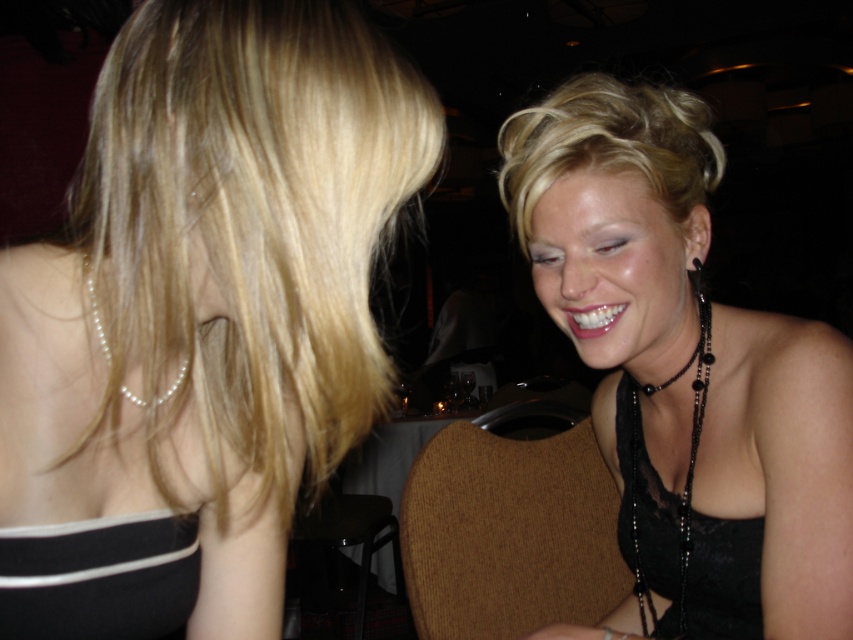
Question: From the image, what is the correct spatial relationship of blonde smooth hair at upper left in relation to black lace dress at upper right?

Choices:
 (A) right
 (B) left

Answer: (B)

Question: Which point appears farthest from the camera in this image?

Choices:
 (A) (144, 515)
 (B) (186, 305)
 (C) (447, 422)
 (D) (679, 198)

Answer: (C)

Question: Does black lace dress at right lie in front of pearl necklace at left?

Choices:
 (A) yes
 (B) no

Answer: (B)

Question: Is black lace dress at right below wooden table at center?

Choices:
 (A) yes
 (B) no

Answer: (B)

Question: Which object appears closest to the camera in this image?

Choices:
 (A) black lace dress at right
 (B) blonde smooth hair at upper left
 (C) black lace dress at upper right
 (D) blonde hair at upper right

Answer: (B)

Question: Which object is farther from the camera taking this photo?

Choices:
 (A) black satin dress at lower left
 (B) pearl necklace at left

Answer: (A)